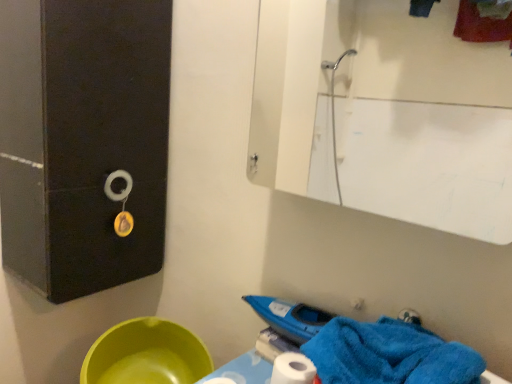
Question: Does white glossy mirror at upper center have a larger size compared to green plastic basin at lower left?

Choices:
 (A) no
 (B) yes

Answer: (B)

Question: From the image's perspective, is white glossy mirror at upper center located above green plastic basin at lower left?

Choices:
 (A) no
 (B) yes

Answer: (B)

Question: From a real-world perspective, is white glossy mirror at upper center positioned over green plastic basin at lower left based on gravity?

Choices:
 (A) yes
 (B) no

Answer: (A)

Question: Does white glossy mirror at upper center have a lesser width compared to green plastic basin at lower left?

Choices:
 (A) yes
 (B) no

Answer: (A)

Question: Is white glossy mirror at upper center closer to camera compared to green plastic basin at lower left?

Choices:
 (A) no
 (B) yes

Answer: (B)

Question: Considering their positions, is green plastic basin at lower left located in front of or behind blue soft towel at lower right?

Choices:
 (A) behind
 (B) front

Answer: (A)

Question: Considering the positions of green plastic basin at lower left and blue soft towel at lower right in the image, is green plastic basin at lower left taller or shorter than blue soft towel at lower right?

Choices:
 (A) tall
 (B) short

Answer: (B)

Question: Is green plastic basin at lower left spatially inside blue soft towel at lower right, or outside of it?

Choices:
 (A) outside
 (B) inside

Answer: (A)

Question: Based on their positions, is green plastic basin at lower left located to the left or right of blue soft towel at lower right?

Choices:
 (A) left
 (B) right

Answer: (A)

Question: From a real-world perspective, is blue soft towel at lower right physically located above or below green plastic basin at lower left?

Choices:
 (A) above
 (B) below

Answer: (A)

Question: From the image's perspective, is blue soft towel at lower right positioned above or below green plastic basin at lower left?

Choices:
 (A) below
 (B) above

Answer: (B)

Question: Based on their positions, is blue soft towel at lower right located to the left or right of green plastic basin at lower left?

Choices:
 (A) left
 (B) right

Answer: (B)

Question: Looking at the image, does blue soft towel at lower right seem bigger or smaller compared to green plastic basin at lower left?

Choices:
 (A) big
 (B) small

Answer: (B)

Question: From the image's perspective, is blue soft towel at lower right located above or below white glossy mirror at upper center?

Choices:
 (A) above
 (B) below

Answer: (B)

Question: Considering their positions, is blue soft towel at lower right located in front of or behind white glossy mirror at upper center?

Choices:
 (A) behind
 (B) front

Answer: (B)